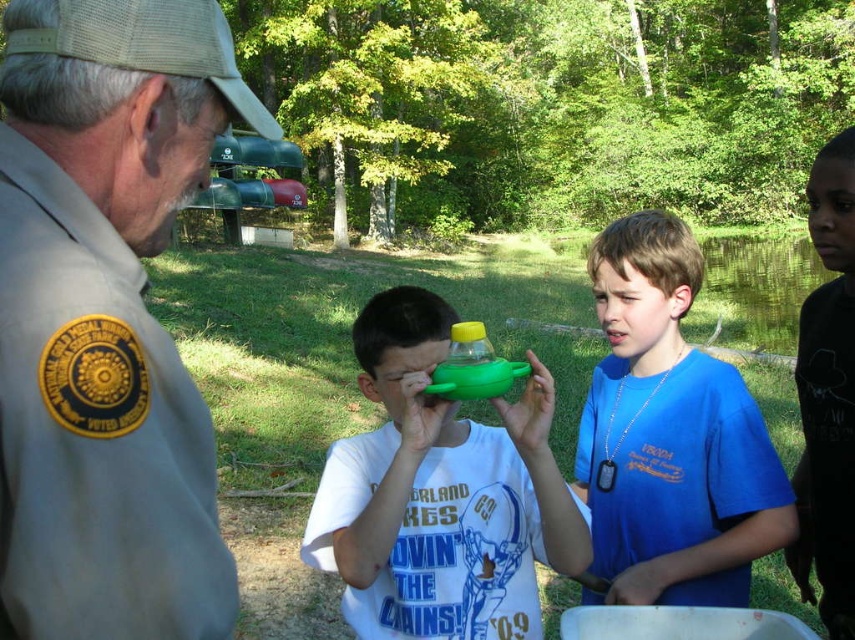
You are a photographer trying to capture a group photo of the tan uniform at left and the green matte toy at center. If you want to ensure both are clearly visible in the frame, which object should you focus on first?

The green matte toy at center should be focused on first because it occupies more space than the tan uniform at left, making it more prominent in the scene.

You are a parent at the park and see your children playing with the green matte toy at center and the blue cotton shirt at center. Which child is holding the toy?

The green matte toy at center is to the left of the blue cotton shirt at center, so the child wearing the blue cotton shirt at center is to the right of the toy. Therefore, the child holding the toy is the one to the left of the blue cotton shirt at center.